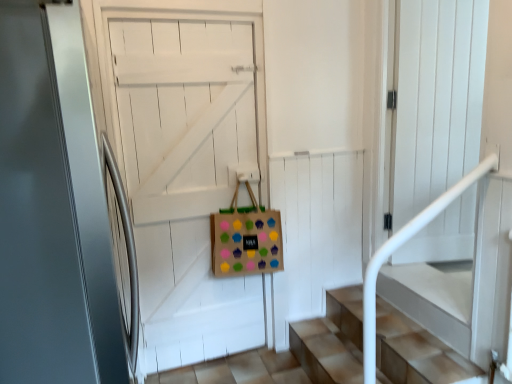
The width and height of the screenshot is (512, 384). What do you see at coordinates (186, 171) in the screenshot? I see `wooden door at center, arranged as the 1th door when viewed from the back` at bounding box center [186, 171].

The image size is (512, 384). Describe the element at coordinates (53, 209) in the screenshot. I see `satin white door at center, positioned as the second door in back-to-front order` at that location.

The height and width of the screenshot is (384, 512). In order to click on brown paper bag with colorful cupcake stickers at center in this screenshot , I will do `click(246, 239)`.

Considering the sizes of brown paper bag with colorful cupcake stickers at center and wooden door at center, the second door from the front, in the image, is brown paper bag with colorful cupcake stickers at center bigger or smaller than wooden door at center, the second door from the front,?

In the image, brown paper bag with colorful cupcake stickers at center appears to be smaller than wooden door at center, the second door from the front.

Is brown paper bag with colorful cupcake stickers at center in front of or behind wooden door at center, arranged as the 1th door when viewed from the back, in the image?

Clearly, brown paper bag with colorful cupcake stickers at center is behind wooden door at center, arranged as the 1th door when viewed from the back.

What's the angular difference between brown paper bag with colorful cupcake stickers at center and wooden door at center, the second door from the front,'s facing directions?

The angular difference between brown paper bag with colorful cupcake stickers at center and wooden door at center, the second door from the front, is 2.63 degrees.

Is brown paper bag with colorful cupcake stickers at center touching satin white door at center, positioned as the second door in back-to-front order?

No, brown paper bag with colorful cupcake stickers at center is not next to satin white door at center, positioned as the second door in back-to-front order.

Does point (271, 248) appear closer or farther from the camera than point (105, 383)?

Point (271, 248) is positioned farther from the camera compared to point (105, 383).

In terms of height, does brown paper bag with colorful cupcake stickers at center look taller or shorter compared to satin white door at center, positioned as the second door in back-to-front order?

brown paper bag with colorful cupcake stickers at center is shorter than satin white door at center, positioned as the second door in back-to-front order.

Between brown paper bag with colorful cupcake stickers at center and satin white door at center, marked as the 1th door in a front-to-back arrangement, which one is positioned behind?

brown paper bag with colorful cupcake stickers at center is further away from the camera.

Between satin white door at center, marked as the 1th door in a front-to-back arrangement, and wooden door at center, arranged as the 1th door when viewed from the back, which one has less height?

wooden door at center, arranged as the 1th door when viewed from the back.

Is satin white door at center, marked as the 1th door in a front-to-back arrangement, not inside wooden door at center, arranged as the 1th door when viewed from the back?

satin white door at center, marked as the 1th door in a front-to-back arrangement, lies outside wooden door at center, arranged as the 1th door when viewed from the back,'s area.

Which object is wider, satin white door at center, marked as the 1th door in a front-to-back arrangement, or wooden door at center, arranged as the 1th door when viewed from the back?

satin white door at center, marked as the 1th door in a front-to-back arrangement.

Is satin white door at center, marked as the 1th door in a front-to-back arrangement, next to wooden door at center, the second door from the front?

There is a gap between satin white door at center, marked as the 1th door in a front-to-back arrangement, and wooden door at center, the second door from the front.

Which is less distant, (184, 31) or (11, 196)?

Point (184, 31) is farther from the camera than point (11, 196).

Considering the sizes of objects wooden door at center, arranged as the 1th door when viewed from the back, and satin white door at center, positioned as the second door in back-to-front order, in the image provided, who is smaller, wooden door at center, arranged as the 1th door when viewed from the back, or satin white door at center, positioned as the second door in back-to-front order,?

With smaller size is wooden door at center, arranged as the 1th door when viewed from the back.

From the picture: From the image's perspective, is wooden door at center, the second door from the front, beneath satin white door at center, positioned as the second door in back-to-front order?

Indeed, from the image's perspective, wooden door at center, the second door from the front, is shown beneath satin white door at center, positioned as the second door in back-to-front order.

Can you tell me how much wooden door at center, the second door from the front, and satin white door at center, positioned as the second door in back-to-front order, differ in facing direction?

The angle between the facing direction of wooden door at center, the second door from the front, and the facing direction of satin white door at center, positioned as the second door in back-to-front order, is 90.6 degrees.

Would you say wooden door at center, arranged as the 1th door when viewed from the back, is outside brown paper bag with colorful cupcake stickers at center?

Absolutely, wooden door at center, arranged as the 1th door when viewed from the back, is external to brown paper bag with colorful cupcake stickers at center.

Considering the relative sizes of wooden door at center, the second door from the front, and brown paper bag with colorful cupcake stickers at center in the image provided, is wooden door at center, the second door from the front, thinner than brown paper bag with colorful cupcake stickers at center?

Correct, the width of wooden door at center, the second door from the front, is less than that of brown paper bag with colorful cupcake stickers at center.

From the picture: From a real-world perspective, who is located lower, wooden door at center, the second door from the front, or brown paper bag with colorful cupcake stickers at center?

wooden door at center, the second door from the front.

Considering the positions of objects wooden door at center, arranged as the 1th door when viewed from the back, and brown paper bag with colorful cupcake stickers at center in the image provided, who is more to the left, wooden door at center, arranged as the 1th door when viewed from the back, or brown paper bag with colorful cupcake stickers at center?

Positioned to the left is wooden door at center, arranged as the 1th door when viewed from the back.

Considering the relative sizes of satin white door at center, positioned as the second door in back-to-front order, and brown paper bag with colorful cupcake stickers at center in the image provided, is satin white door at center, positioned as the second door in back-to-front order, wider than brown paper bag with colorful cupcake stickers at center?

Correct, the width of satin white door at center, positioned as the second door in back-to-front order, exceeds that of brown paper bag with colorful cupcake stickers at center.

Is satin white door at center, positioned as the second door in back-to-front order, facing away from brown paper bag with colorful cupcake stickers at center?

No, satin white door at center, positioned as the second door in back-to-front order,'s orientation is not away from brown paper bag with colorful cupcake stickers at center.

The image size is (512, 384). I want to click on shopping bag below the satin white door at center, marked as the 1th door in a front-to-back arrangement (from a real-world perspective), so tap(246, 239).

Is the surface of satin white door at center, marked as the 1th door in a front-to-back arrangement, in direct contact with brown paper bag with colorful cupcake stickers at center?

No, satin white door at center, marked as the 1th door in a front-to-back arrangement, is not making contact with brown paper bag with colorful cupcake stickers at center.

At what (x,y) coordinates should I click in order to perform the action: click on the 1st door to the left when counting from the brown paper bag with colorful cupcake stickers at center. Please return your answer as a coordinate pair (x, y). This screenshot has width=512, height=384. Looking at the image, I should click on click(x=186, y=171).

Image resolution: width=512 pixels, height=384 pixels. What are the coordinates of `shopping bag on the right side of satin white door at center, marked as the 1th door in a front-to-back arrangement` in the screenshot? It's located at (246, 239).

From the image, which object appears to be nearer to brown paper bag with colorful cupcake stickers at center, wooden door at center, the second door from the front, or satin white door at center, positioned as the second door in back-to-front order?

wooden door at center, the second door from the front, is closer to brown paper bag with colorful cupcake stickers at center.

Looking at the image, which one is located further to brown paper bag with colorful cupcake stickers at center, satin white door at center, marked as the 1th door in a front-to-back arrangement, or wooden door at center, arranged as the 1th door when viewed from the back?

satin white door at center, marked as the 1th door in a front-to-back arrangement, is positioned further to the anchor brown paper bag with colorful cupcake stickers at center.

Looking at the image, which one is located further to satin white door at center, positioned as the second door in back-to-front order, brown paper bag with colorful cupcake stickers at center or wooden door at center, arranged as the 1th door when viewed from the back?

brown paper bag with colorful cupcake stickers at center is further to satin white door at center, positioned as the second door in back-to-front order.

Considering their positions, is brown paper bag with colorful cupcake stickers at center positioned closer to wooden door at center, the second door from the front, than satin white door at center, positioned as the second door in back-to-front order?

Based on the image, brown paper bag with colorful cupcake stickers at center appears to be nearer to wooden door at center, the second door from the front.

Estimate the real-world distances between objects in this image. Which object is further from satin white door at center, positioned as the second door in back-to-front order, wooden door at center, arranged as the 1th door when viewed from the back, or brown paper bag with colorful cupcake stickers at center?

The object further to satin white door at center, positioned as the second door in back-to-front order, is brown paper bag with colorful cupcake stickers at center.

Estimate the real-world distances between objects in this image. Which object is closer to wooden door at center, the second door from the front, satin white door at center, positioned as the second door in back-to-front order, or brown paper bag with colorful cupcake stickers at center?

brown paper bag with colorful cupcake stickers at center lies closer to wooden door at center, the second door from the front, than the other object.

Find the location of a particular element. door located between satin white door at center, positioned as the second door in back-to-front order, and brown paper bag with colorful cupcake stickers at center in the depth direction is located at coordinates (186, 171).